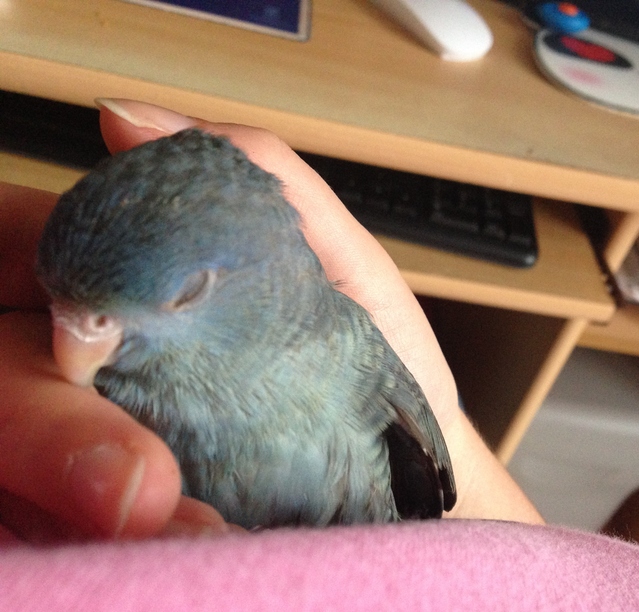
The width and height of the screenshot is (639, 612). In order to click on keyboard in this screenshot , I will do `click(489, 226)`.